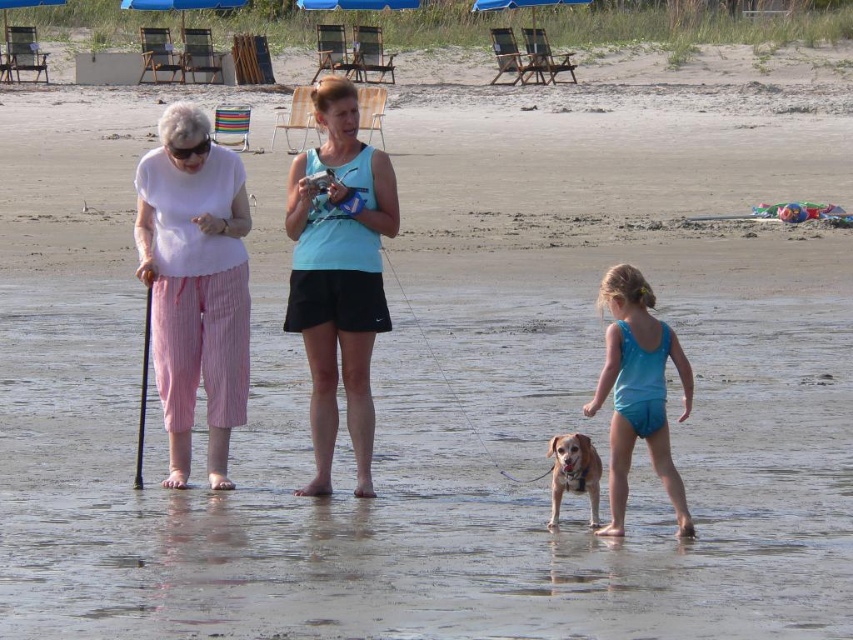
You are a photographer trying to capture a photo of the brown fur dog at center without the blue fabric swimsuit at lower right appearing in the foreground. Is this possible based on their positions?

The blue fabric swimsuit at lower right is in front of the brown fur dog at center, so it would block the view. Move to a different angle to avoid the swimsuit.

You are a photographer standing at the center of the beach scene. You need to capture a wide shot that includes both the light blue fabric tank top at center and the blue fabric umbrella at upper center in the same frame. Given that your camera has a maximum focal length that allows capturing objects up to 30 meters apart, will you be able to include both subjects in the shot?

The light blue fabric tank top at center and blue fabric umbrella at upper center are 37.40 meters apart from each other. Since the maximum focal length of the camera only allows capturing objects up to 30 meters apart, the distance between them exceeds this limit. Therefore, you will not be able to include both subjects in the same frame with the current camera settings.

You are a photographer trying to capture a wide shot of the beach scene. You need to position yourself so that the blue fabric swimsuit at lower right and the camera are both in frame. Given the distance between them, can you estimate if a standard 50mm lens will allow you to include both in your shot without moving closer?

The distance between the blue fabric swimsuit at lower right and the camera is 10.17 meters. A standard 50mm lens has a field of view that can typically capture subjects within a 10 meter range at a normal shooting distance. Therefore, using a 50mm lens should allow both the blue fabric swimsuit at lower right and the camera to be in frame without needing to move closer.